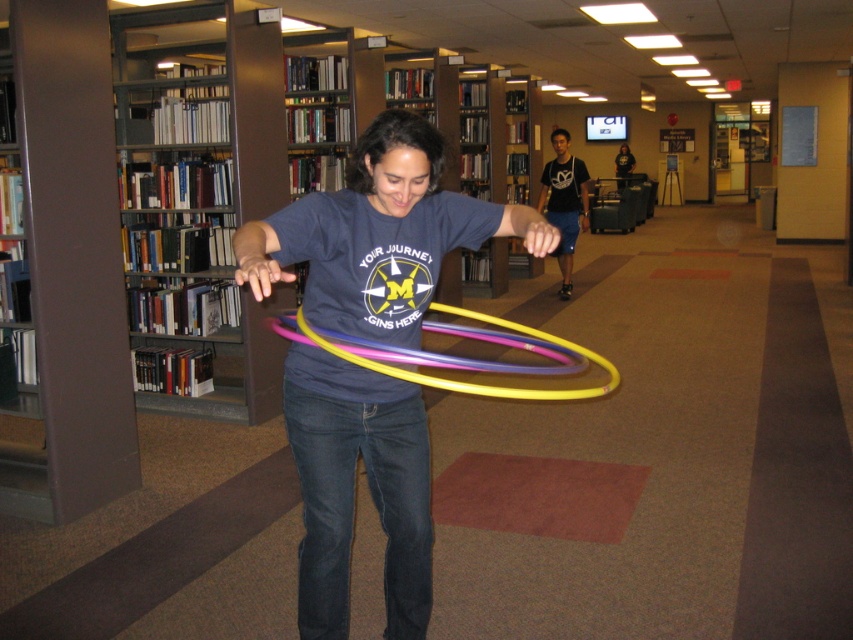
You are standing at the origin point in the library. Where is the wooden bookshelf at left located in 2D coordinates?

The wooden bookshelf at left is located at coordinates (163, 195).